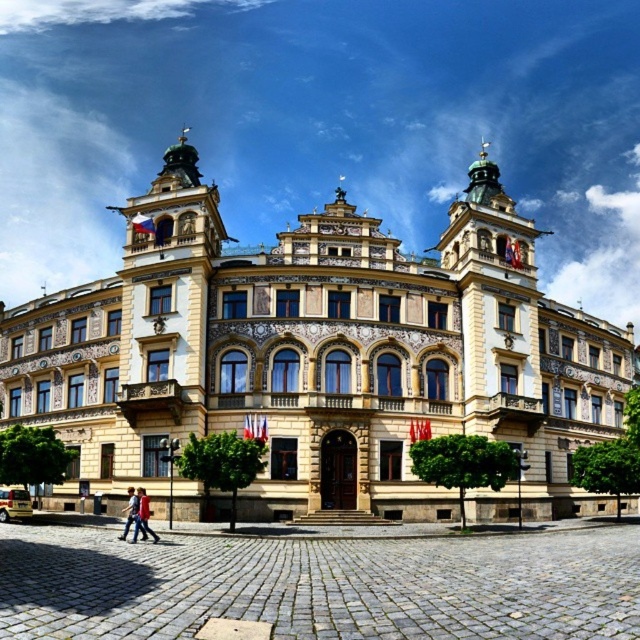
Who is shorter, yellow stone building at center or brown cobblestone square at center?

brown cobblestone square at center is shorter.

What do you see at coordinates (316, 353) in the screenshot?
I see `yellow stone building at center` at bounding box center [316, 353].

The image size is (640, 640). What do you see at coordinates (316, 353) in the screenshot?
I see `yellow stone building at center` at bounding box center [316, 353].

Identify the location of yellow stone building at center. The width and height of the screenshot is (640, 640). (316, 353).

Is point (241, 637) behind point (132, 516)?

That is False.

Who is positioned more to the left, brown cobblestone square at center or red jacket at lower left?

From the viewer's perspective, red jacket at lower left appears more on the left side.

Find the location of a particular element. Image resolution: width=640 pixels, height=640 pixels. brown cobblestone square at center is located at coordinates [x=234, y=628].

Where is `brown cobblestone square at center`? The image size is (640, 640). brown cobblestone square at center is located at coordinates (234, 628).

Is red shirt at lower left wider than red jacket at lower left?

No.

What do you see at coordinates (144, 516) in the screenshot? This screenshot has width=640, height=640. I see `red shirt at lower left` at bounding box center [144, 516].

At what (x,y) coordinates should I click in order to perform the action: click on red shirt at lower left. Please return your answer as a coordinate pair (x, y). Image resolution: width=640 pixels, height=640 pixels. Looking at the image, I should click on (144, 516).